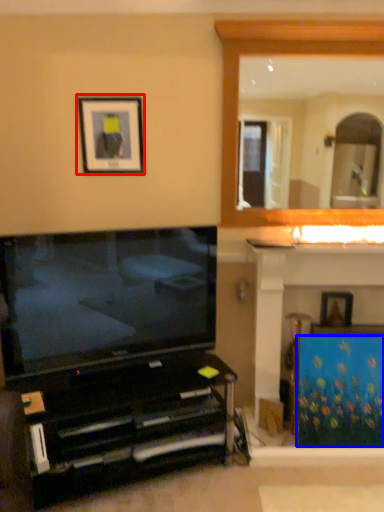
Question: Which of the following is the farthest to the observer, picture frame (highlighted by a red box) or curtain (highlighted by a blue box)?

Choices:
 (A) picture frame
 (B) curtain

Answer: (A)